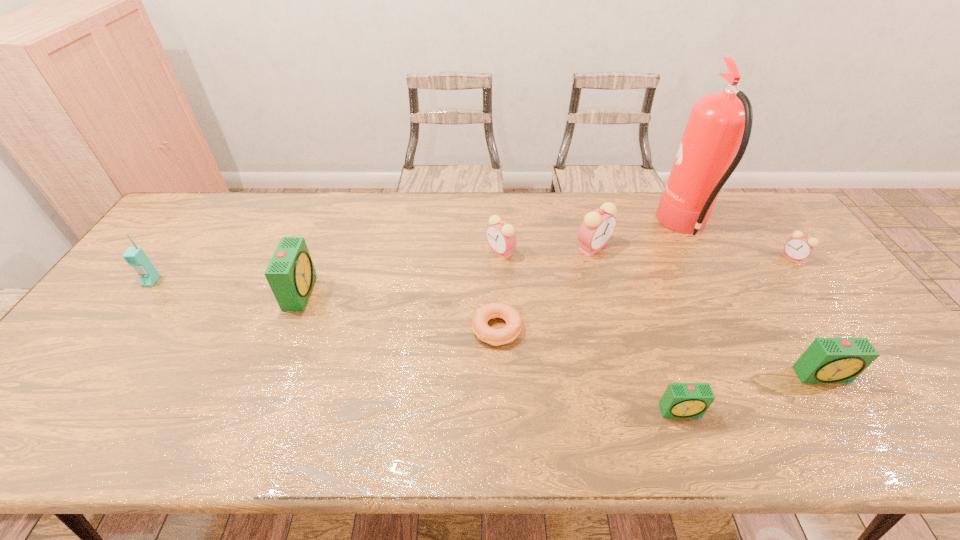
I want to click on vacant point located 0.140m on the right of the shortest object, so click(575, 329).

In order to click on object located in the far edge section of the desktop in this screenshot , I will do `click(719, 124)`.

In order to click on object present at the near edge in this screenshot , I will do `click(680, 400)`.

I want to click on object that is at the left edge, so click(x=135, y=256).

Where is `free space at the far edge of the desktop`? Image resolution: width=960 pixels, height=540 pixels. free space at the far edge of the desktop is located at coordinates (296, 229).

The height and width of the screenshot is (540, 960). Identify the location of blank space at the near edge of the desktop. (612, 422).

This screenshot has width=960, height=540. In the image, there is a desktop. What are the coordinates of `blank space at the right edge` in the screenshot? It's located at (884, 400).

Locate an element on the screen. This screenshot has height=540, width=960. free space at the far right corner of the desktop is located at coordinates (761, 218).

Where is `vacant space that's between the second alarm clock from left to right and the bagel`? The image size is (960, 540). vacant space that's between the second alarm clock from left to right and the bagel is located at coordinates (499, 290).

The image size is (960, 540). What are the coordinates of `vacant space in between the leftmost object and the tallest object` in the screenshot? It's located at (418, 254).